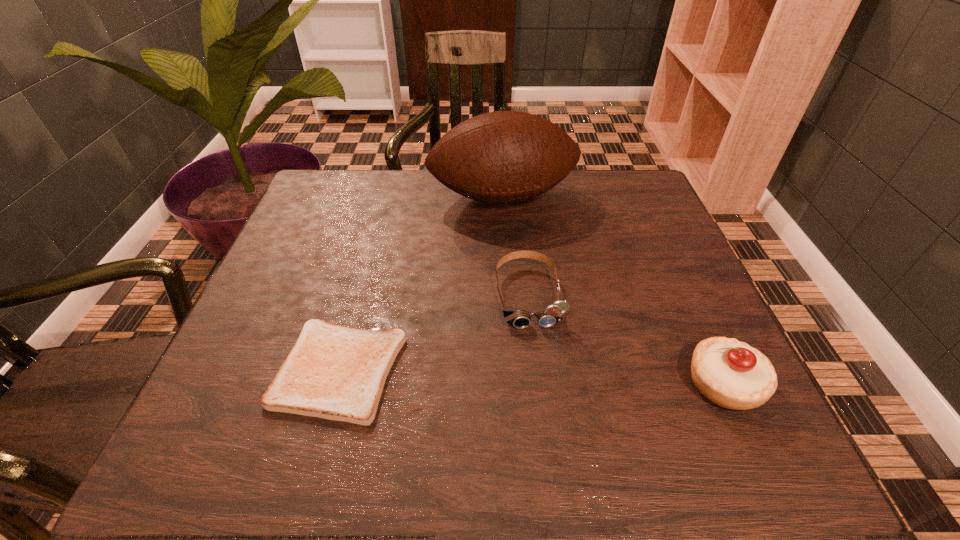
Locate an element on the screen. The width and height of the screenshot is (960, 540). the shortest object is located at coordinates (338, 373).

The image size is (960, 540). I want to click on toast, so click(338, 373).

Locate an element on the screen. The width and height of the screenshot is (960, 540). the rightmost object is located at coordinates (731, 374).

Locate an element on the screen. the third shortest object is located at coordinates (731, 374).

Find the location of `the tallest object`. the tallest object is located at coordinates (498, 157).

The image size is (960, 540). I want to click on football, so click(x=498, y=157).

Identify the location of goggles. The height and width of the screenshot is (540, 960). (520, 319).

What are the coordinates of `free space located on the right of the leftmost object` in the screenshot? It's located at (610, 370).

Find the location of a particular element. vacant region located 0.270m on the left of the rightmost object is located at coordinates (531, 383).

This screenshot has height=540, width=960. I want to click on free space located on the laces of the tallest object, so click(x=549, y=306).